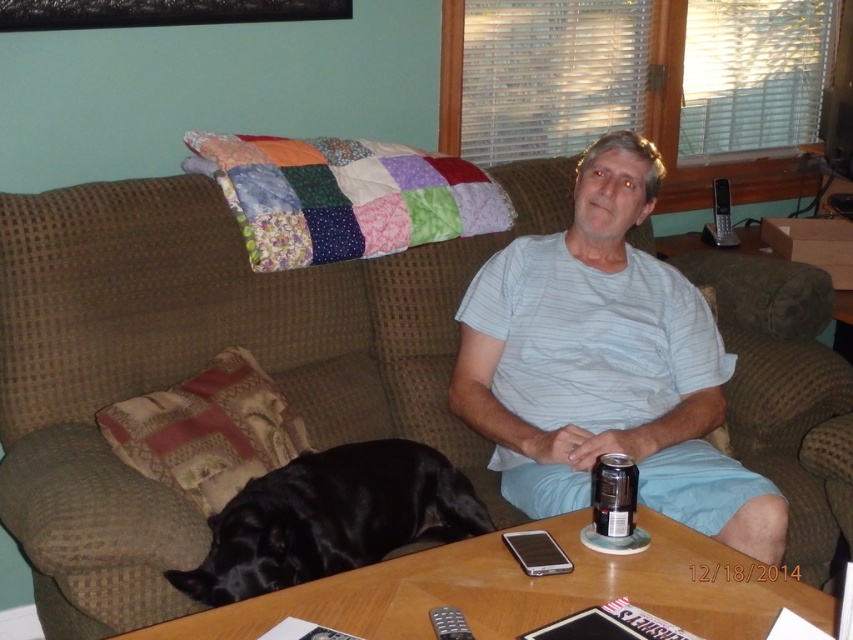
Question: Does dark matte can at center come in front of black plastic remote at lower center?

Choices:
 (A) no
 (B) yes

Answer: (A)

Question: Observing the image, what is the correct spatial positioning of black smooth dog at lower left in reference to black plastic remote at lower center?

Choices:
 (A) left
 (B) right

Answer: (A)

Question: Can you confirm if black smooth dog at lower left is positioned above dark matte can at center?

Choices:
 (A) no
 (B) yes

Answer: (A)

Question: Among these objects, which one is farthest from the camera?

Choices:
 (A) dark matte can at center
 (B) light blue striped shirt at center

Answer: (B)

Question: Which point is farther from the camera taking this photo?

Choices:
 (A) (460, 618)
 (B) (726, 365)
 (C) (325, 570)

Answer: (B)

Question: Which point is farther from the camera taking this photo?

Choices:
 (A) [314, 488]
 (B) [611, 528]
 (C) [691, 493]
 (D) [462, 630]

Answer: (C)